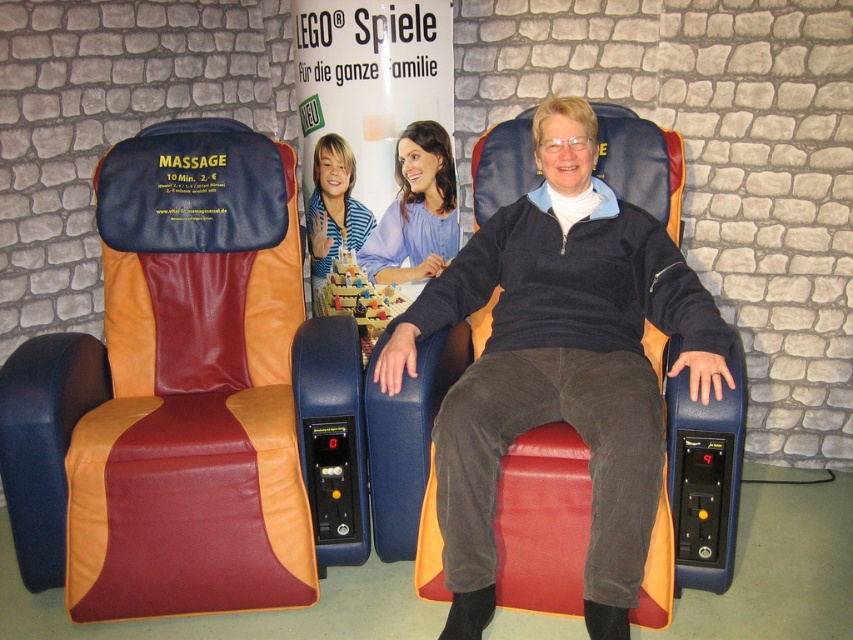
Question: Estimate the real-world distances between objects in this image. Which object is farther from the matte blue shirt at center?

Choices:
 (A) matte blue massage chair at center
 (B) maroon leather massage chair at left
 (C) striped shirt at center

Answer: (B)

Question: Can you confirm if matte blue massage chair at center is positioned below matte blue shirt at center?

Choices:
 (A) no
 (B) yes

Answer: (B)

Question: Which of these objects is positioned farthest from the matte blue massage chair at center?

Choices:
 (A) striped shirt at center
 (B) maroon leather massage chair at left
 (C) matte blue shirt at center

Answer: (A)

Question: Which point is closer to the camera?

Choices:
 (A) (363, 228)
 (B) (461, 458)
 (C) (137, 250)

Answer: (B)

Question: Is matte blue shirt at center positioned in front of striped shirt at center?

Choices:
 (A) yes
 (B) no

Answer: (A)

Question: Is matte blue massage chair at center further to the viewer compared to matte blue shirt at center?

Choices:
 (A) yes
 (B) no

Answer: (B)